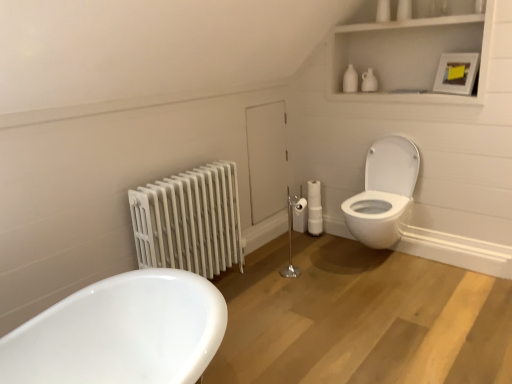
Find the location of `free space between white painted metal radiator at left and silver metallic toilet paper holder at center`. free space between white painted metal radiator at left and silver metallic toilet paper holder at center is located at coordinates (261, 282).